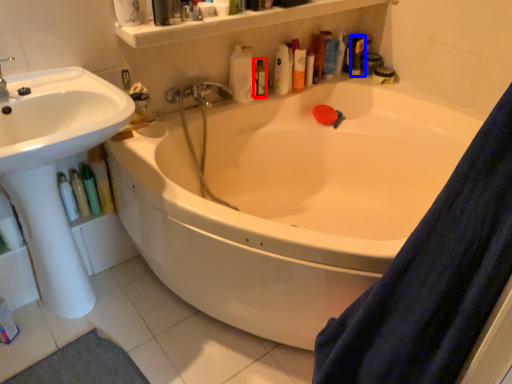
Question: Which object is further to the camera taking this photo, toiletry (highlighted by a red box) or toiletry (highlighted by a blue box)?

Choices:
 (A) toiletry
 (B) toiletry

Answer: (B)